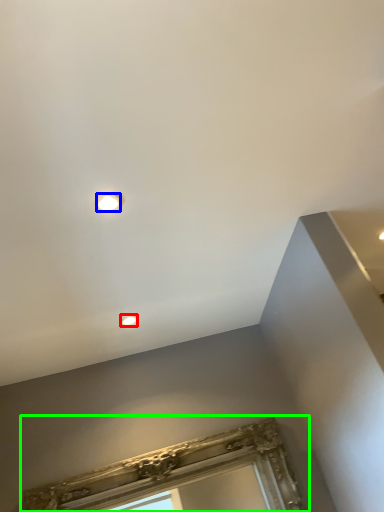
Question: Estimate the real-world distances between objects in this image. Which object is closer to droplight (highlighted by a red box), droplight (highlighted by a blue box) or window frame (highlighted by a green box)?

Choices:
 (A) droplight
 (B) window frame

Answer: (B)